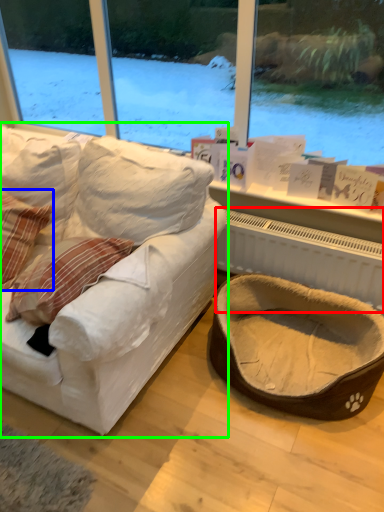
Question: Which is farther away from radiator (highlighted by a red box)? pillow (highlighted by a blue box) or studio couch (highlighted by a green box)?

Choices:
 (A) pillow
 (B) studio couch

Answer: (A)